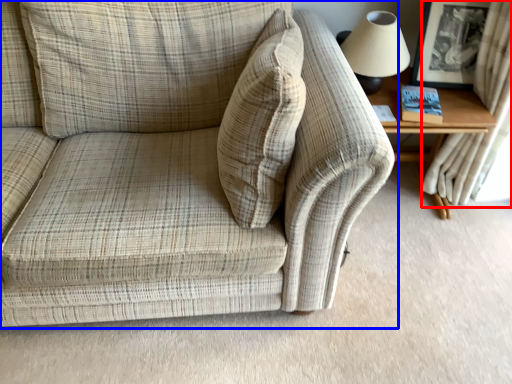
Question: Which of the following is the farthest to the observer, curtain (highlighted by a red box) or studio couch (highlighted by a blue box)?

Choices:
 (A) curtain
 (B) studio couch

Answer: (A)